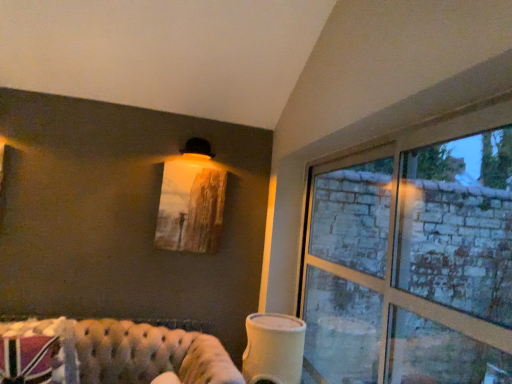
Locate an element on the screen. The width and height of the screenshot is (512, 384). clear glass window at right is located at coordinates (413, 258).

Describe the element at coordinates (273, 348) in the screenshot. I see `white matte cup at lower center` at that location.

The image size is (512, 384). In order to click on matte wooden picture frame at upper center in this screenshot , I will do tap(190, 206).

What do you see at coordinates (190, 206) in the screenshot? Image resolution: width=512 pixels, height=384 pixels. I see `matte wooden picture frame at upper center` at bounding box center [190, 206].

Image resolution: width=512 pixels, height=384 pixels. What do you see at coordinates (347, 268) in the screenshot? I see `clear glass window at right` at bounding box center [347, 268].

This screenshot has height=384, width=512. What are the coordinates of `clear glass window at right` in the screenshot? It's located at (413, 258).

Which of these two, clear glass window at right or clear glass window at right, is smaller?

clear glass window at right is smaller.

Considering the positions of points (309, 338) and (383, 216), is point (309, 338) farther from camera compared to point (383, 216)?

No, it is not.

How much distance is there between clear glass window at right and clear glass window at right?

clear glass window at right is 0.93 inches from clear glass window at right.

From a real-world perspective, which is physically above, clear glass window at right or clear glass window at right?

From a 3D spatial view, clear glass window at right is above.

What's the angular difference between white matte cup at lower center and matte wooden picture frame at upper center's facing directions?

white matte cup at lower center and matte wooden picture frame at upper center are facing 4.6 degrees away from each other.

Which is correct: white matte cup at lower center is inside matte wooden picture frame at upper center, or outside of it?

white matte cup at lower center is not enclosed by matte wooden picture frame at upper center.

Which is nearer, (x=264, y=366) or (x=215, y=242)?

Point (x=264, y=366) appears to be closer to the viewer than point (x=215, y=242).

Between clear glass window at right and tufted leather couch at lower left, which one appears on the right side from the viewer's perspective?

clear glass window at right.

Looking at this image, can you tell me how much clear glass window at right and tufted leather couch at lower left differ in facing direction?

They differ by 95.3 degrees in their facing directions.

Which object is closer to the camera taking this photo, clear glass window at right or tufted leather couch at lower left?

Positioned in front is clear glass window at right.

Is clear glass window at right facing away from tufted leather couch at lower left?

No, clear glass window at right's orientation is not away from tufted leather couch at lower left.

Which is more to the right, tufted leather couch at lower left or matte wooden picture frame at upper center?

Positioned to the right is matte wooden picture frame at upper center.

Could matte wooden picture frame at upper center be considered to be inside tufted leather couch at lower left?

Definitely not — matte wooden picture frame at upper center is not inside tufted leather couch at lower left.

Is tufted leather couch at lower left turned away from matte wooden picture frame at upper center?

No, tufted leather couch at lower left's orientation is not away from matte wooden picture frame at upper center.

From the image's perspective, is tufted leather couch at lower left located above or below matte wooden picture frame at upper center?

tufted leather couch at lower left is situated lower than matte wooden picture frame at upper center in the image.

Does clear glass window at right contain clear glass window at right?

Yes, clear glass window at right is a part of clear glass window at right.

Considering the relative sizes of clear glass window at right and clear glass window at right in the image provided, is clear glass window at right smaller than clear glass window at right?

Incorrect, clear glass window at right is not smaller in size than clear glass window at right.

Between clear glass window at right and clear glass window at right, which one appears on the right side from the viewer's perspective?

clear glass window at right is more to the right.

Considering the sizes of clear glass window at right and clear glass window at right in the image, is clear glass window at right wider or thinner than clear glass window at right?

Clearly, clear glass window at right has more width compared to clear glass window at right.

Which is more to the left, matte wooden picture frame at upper center or tufted leather couch at lower left?

From the viewer's perspective, tufted leather couch at lower left appears more on the left side.

From a real-world perspective, which is physically below, matte wooden picture frame at upper center or tufted leather couch at lower left?

tufted leather couch at lower left, from a real-world perspective.

Does matte wooden picture frame at upper center turn towards tufted leather couch at lower left?

No, matte wooden picture frame at upper center is not aimed at tufted leather couch at lower left.

Is there a large distance between matte wooden picture frame at upper center and tufted leather couch at lower left?

No, there isn't a large distance between matte wooden picture frame at upper center and tufted leather couch at lower left.

From a real-world perspective, who is located higher, white matte cup at lower center or clear glass window at right?

clear glass window at right.

Considering the positions of objects white matte cup at lower center and clear glass window at right in the image provided, who is in front, white matte cup at lower center or clear glass window at right?

Positioned in front is clear glass window at right.

Between white matte cup at lower center and clear glass window at right, which one has larger width?

white matte cup at lower center is wider.

Where is `table lamp below the clear glass window at right (from the image's perspective)`? table lamp below the clear glass window at right (from the image's perspective) is located at coordinates (273, 348).

I want to click on window in front of the clear glass window at right, so click(x=413, y=258).

Locate an element on the screen. picture frame lying on the left of white matte cup at lower center is located at coordinates (190, 206).

Looking at this image, considering their positions, is white matte cup at lower center positioned closer to clear glass window at right than clear glass window at right?

clear glass window at right is closer to clear glass window at right.

Estimate the real-world distances between objects in this image. Which object is further from white matte cup at lower center, tufted leather couch at lower left or clear glass window at right?

tufted leather couch at lower left.

Based on their spatial positions, is tufted leather couch at lower left or clear glass window at right closer to white matte cup at lower center?

Based on the image, clear glass window at right appears to be nearer to white matte cup at lower center.

When comparing their distances from clear glass window at right, does white matte cup at lower center or matte wooden picture frame at upper center seem closer?

white matte cup at lower center lies closer to clear glass window at right than the other object.

Looking at the image, which one is located closer to clear glass window at right, tufted leather couch at lower left or white matte cup at lower center?

Based on the image, white matte cup at lower center appears to be nearer to clear glass window at right.

Considering their positions, is tufted leather couch at lower left positioned closer to matte wooden picture frame at upper center than clear glass window at right?

tufted leather couch at lower left lies closer to matte wooden picture frame at upper center than the other object.

From the image, which object appears to be nearer to clear glass window at right, clear glass window at right or white matte cup at lower center?

clear glass window at right is positioned closer to the anchor clear glass window at right.

From the image, which object appears to be farther from white matte cup at lower center, matte wooden picture frame at upper center or tufted leather couch at lower left?

matte wooden picture frame at upper center lies further to white matte cup at lower center than the other object.

Image resolution: width=512 pixels, height=384 pixels. What are the coordinates of `studio couch between clear glass window at right and white matte cup at lower center in the front-back direction` in the screenshot? It's located at (110, 354).

Where is `window frame positioned between clear glass window at right and matte wooden picture frame at upper center from near to far`? window frame positioned between clear glass window at right and matte wooden picture frame at upper center from near to far is located at coordinates (347, 268).

Where is `window frame located between clear glass window at right and white matte cup at lower center in the depth direction`? The width and height of the screenshot is (512, 384). window frame located between clear glass window at right and white matte cup at lower center in the depth direction is located at coordinates (347, 268).

Identify the location of table lamp situated between tufted leather couch at lower left and clear glass window at right from left to right. The image size is (512, 384). (273, 348).